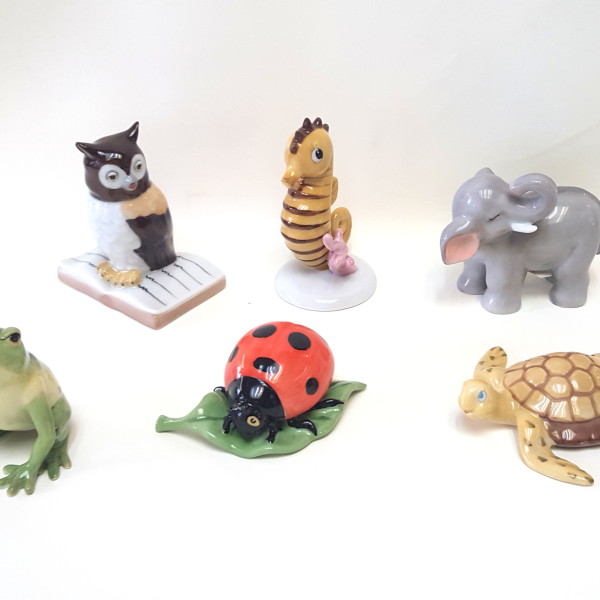
Find the location of a particular element. figurine is located at coordinates (16, 390), (152, 234), (304, 228), (300, 365), (554, 247), (563, 393).